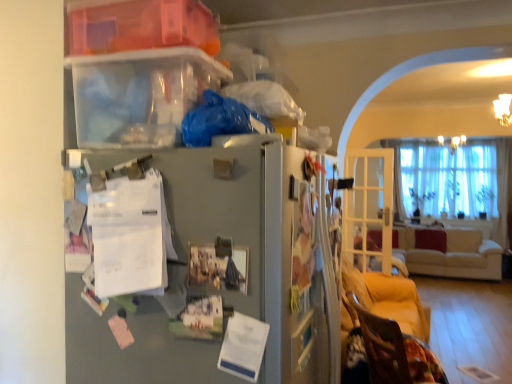
You are a GUI agent. You are given a task and a screenshot of the screen. Output one action in this format:
    pyautogui.click(x=<x>, y=<y>)
    Task: Click on the velvet brown armchair at lower right
    Image resolution: width=512 pixels, height=384 pixels.
    Given the screenshot: What is the action you would take?
    pyautogui.click(x=382, y=346)

You are a GUI agent. You are given a task and a screenshot of the screen. Output one action in this format:
    pyautogui.click(x=<x>, y=<y>)
    Task: Click on the metallic gray fridge at center
    Image resolution: width=512 pixels, height=384 pixels.
    Given the screenshot: What is the action you would take?
    [257, 244]

Where is `velvet brown armchair at lower right`? velvet brown armchair at lower right is located at coordinates (382, 346).

Can you confirm if translucent plastic storage box at upper left is taller than clear glass door at right?

No, translucent plastic storage box at upper left is not taller than clear glass door at right.

Does point (185, 16) lie in front of point (366, 177)?

Yes, point (185, 16) is closer to viewer.

Between translucent plastic storage box at upper left and clear glass door at right, which one is positioned in front?

translucent plastic storage box at upper left.

From a real-world perspective, is beige fabric couch at right physically above clear glass door at right?

No.

Considering the relative sizes of beige fabric couch at right and clear glass door at right in the image provided, is beige fabric couch at right thinner than clear glass door at right?

No.

Are beige fabric couch at right and clear glass door at right far apart?

Absolutely, beige fabric couch at right is distant from clear glass door at right.

From the image's perspective, which object appears higher, velvet brown armchair at lower right or translucent plastic storage box at upper left?

translucent plastic storage box at upper left appears higher in the image.

Considering the relative positions of velvet brown armchair at lower right and translucent plastic storage box at upper left in the image provided, is velvet brown armchair at lower right to the right of translucent plastic storage box at upper left from the viewer's perspective?

Indeed, velvet brown armchair at lower right is positioned on the right side of translucent plastic storage box at upper left.

Find the location of a particular element. The width and height of the screenshot is (512, 384). storage box above the velvet brown armchair at lower right (from a real-world perspective) is located at coordinates (143, 26).

Consider the image. Can you confirm if velvet brown armchair at lower right is smaller than translucent plastic storage box at upper left?

No, velvet brown armchair at lower right is not smaller than translucent plastic storage box at upper left.

Can you confirm if translucent plastic storage box at upper left is bigger than metallic gray fridge at center?

No, translucent plastic storage box at upper left is not bigger than metallic gray fridge at center.

Considering the relative positions of translucent plastic storage box at upper left and metallic gray fridge at center in the image provided, is translucent plastic storage box at upper left to the right of metallic gray fridge at center from the viewer's perspective?

No.

Does translucent plastic storage box at upper left turn towards metallic gray fridge at center?

No, translucent plastic storage box at upper left is not aimed at metallic gray fridge at center.

Is metallic gray fridge at center completely or partially inside translucent plastic storage box at upper left?

No, metallic gray fridge at center is not a part of translucent plastic storage box at upper left.

Is beige fabric couch at right located outside translucent plastic storage box at upper left?

Yes, beige fabric couch at right is located beyond the bounds of translucent plastic storage box at upper left.

Could you tell me if beige fabric couch at right is facing translucent plastic storage box at upper left?

No, beige fabric couch at right does not turn towards translucent plastic storage box at upper left.

Considering the relative sizes of beige fabric couch at right and translucent plastic storage box at upper left in the image provided, is beige fabric couch at right smaller than translucent plastic storage box at upper left?

No.

From the image's perspective, who appears lower, beige fabric couch at right or translucent plastic storage box at upper left?

beige fabric couch at right.

Is point (305, 324) positioned after point (408, 242)?

No, (305, 324) is in front of (408, 242).

From the image's perspective, is metallic gray fridge at center under beige fabric couch at right?

No, from the image's perspective, metallic gray fridge at center is not beneath beige fabric couch at right.

Where is `fridge on the left side of beige fabric couch at right`? fridge on the left side of beige fabric couch at right is located at coordinates (257, 244).

Measure the distance between clear glass door at right and metallic gray fridge at center.

clear glass door at right and metallic gray fridge at center are 3.34 meters apart.

Does clear glass door at right have a smaller size compared to metallic gray fridge at center?

Yes, clear glass door at right is smaller than metallic gray fridge at center.

Between clear glass door at right and metallic gray fridge at center, which one appears on the left side from the viewer's perspective?

metallic gray fridge at center.

Locate an element on the screen. storage box above the clear glass door at right (from the image's perspective) is located at coordinates (143, 26).

Identify the location of studio couch behind the clear glass door at right. This screenshot has height=384, width=512. tap(453, 254).

Based on their spatial positions, is metallic gray fridge at center or beige fabric couch at right closer to translucent plastic storage box at upper left?

metallic gray fridge at center lies closer to translucent plastic storage box at upper left than the other object.

Looking at this image, estimate the real-world distances between objects in this image. Which object is further from translucent plastic storage box at upper left, beige fabric couch at right or velvet brown armchair at lower right?

beige fabric couch at right is positioned further to the anchor translucent plastic storage box at upper left.

In the scene shown: Considering their positions, is translucent plastic storage box at upper left positioned closer to velvet brown armchair at lower right than clear glass door at right?

translucent plastic storage box at upper left lies closer to velvet brown armchair at lower right than the other object.

Which object lies further to the anchor point beige fabric couch at right, translucent plastic storage box at upper left or clear glass door at right?

The object further to beige fabric couch at right is translucent plastic storage box at upper left.

Estimate the real-world distances between objects in this image. Which object is further from velvet brown armchair at lower right, metallic gray fridge at center or clear glass door at right?

clear glass door at right lies further to velvet brown armchair at lower right than the other object.

Which object lies nearer to the anchor point velvet brown armchair at lower right, beige fabric couch at right or clear glass door at right?

Among the two, clear glass door at right is located nearer to velvet brown armchair at lower right.

From the image, which object appears to be nearer to beige fabric couch at right, clear glass door at right or velvet brown armchair at lower right?

clear glass door at right is closer to beige fabric couch at right.

Estimate the real-world distances between objects in this image. Which object is closer to metallic gray fridge at center, beige fabric couch at right or velvet brown armchair at lower right?

The object closer to metallic gray fridge at center is velvet brown armchair at lower right.

Find the location of a particular element. This screenshot has height=384, width=512. armchair between translucent plastic storage box at upper left and clear glass door at right from front to back is located at coordinates (382, 346).

Locate an element on the screen. armchair located between metallic gray fridge at center and beige fabric couch at right in the depth direction is located at coordinates (382, 346).

Find the location of `armchair between metallic gray fridge at center and clear glass door at right from front to back`. armchair between metallic gray fridge at center and clear glass door at right from front to back is located at coordinates (382, 346).

Where is `storage box located between metallic gray fridge at center and clear glass door at right in the depth direction`? The width and height of the screenshot is (512, 384). storage box located between metallic gray fridge at center and clear glass door at right in the depth direction is located at coordinates (143, 26).